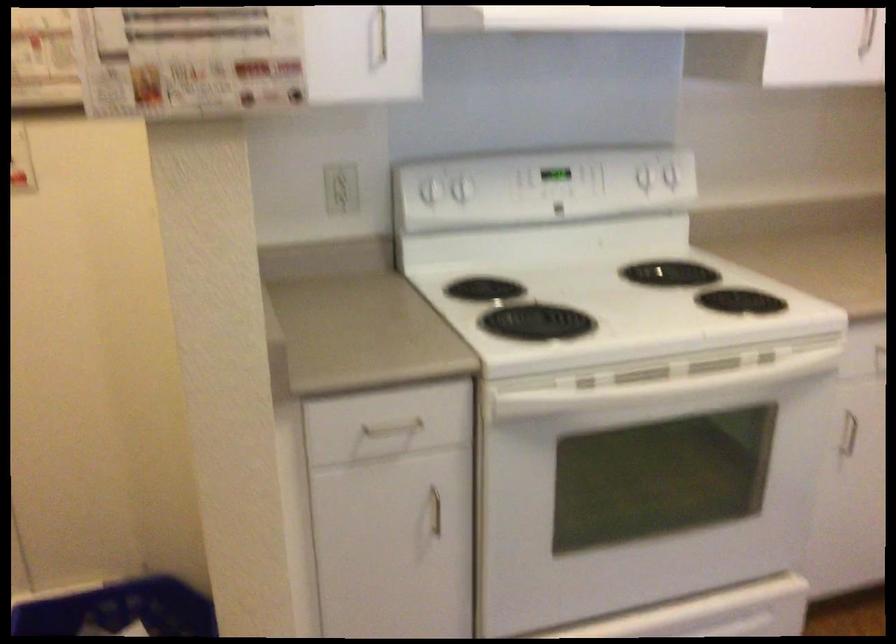
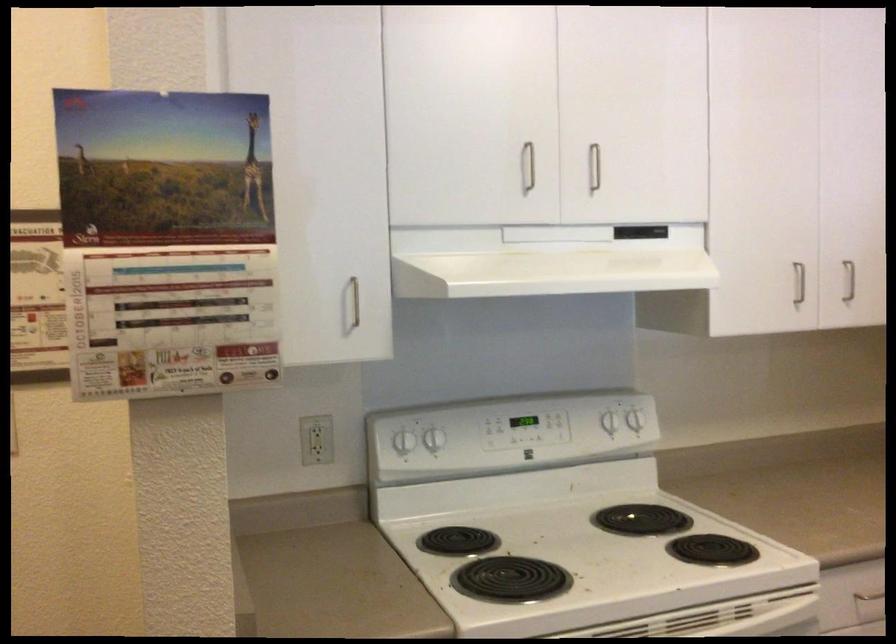
Where in the second image is the point corresponding to the point at 428,180 from the first image?

(400, 433)